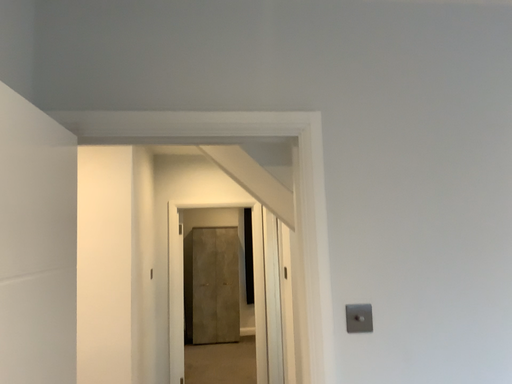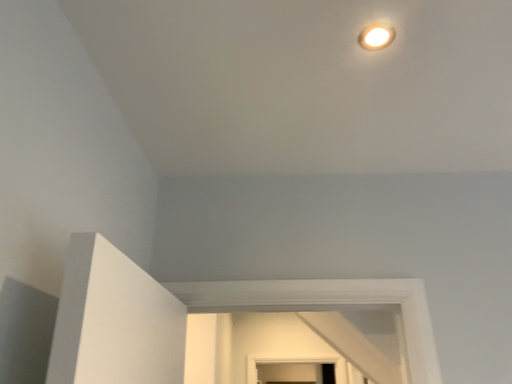
Question: Which way did the camera rotate in the video?

Choices:
 (A) rotated upward
 (B) rotated downward

Answer: (A)